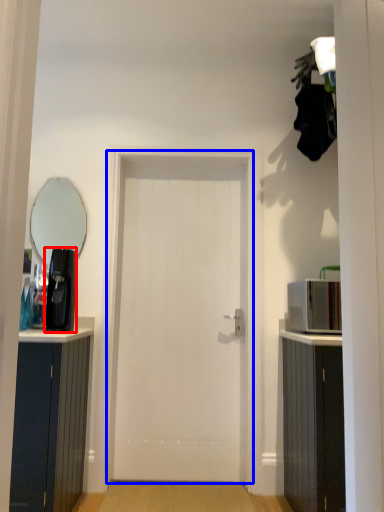
Question: Which point is further to the camera, coffee machine (highlighted by a red box) or door (highlighted by a blue box)?

Choices:
 (A) coffee machine
 (B) door

Answer: (B)